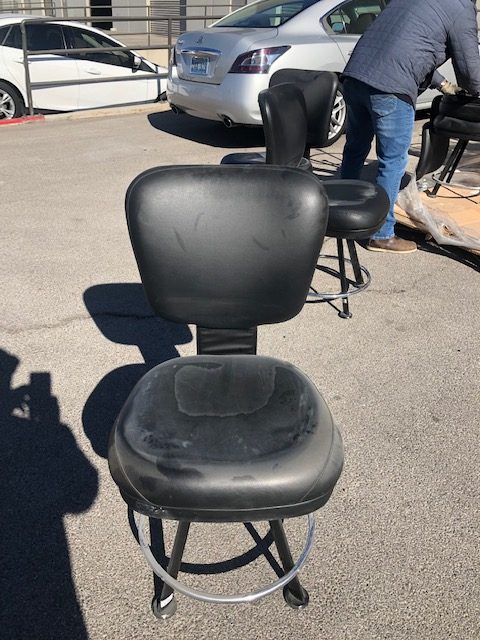
Image resolution: width=480 pixels, height=640 pixels. I want to click on board, so click(x=447, y=224).